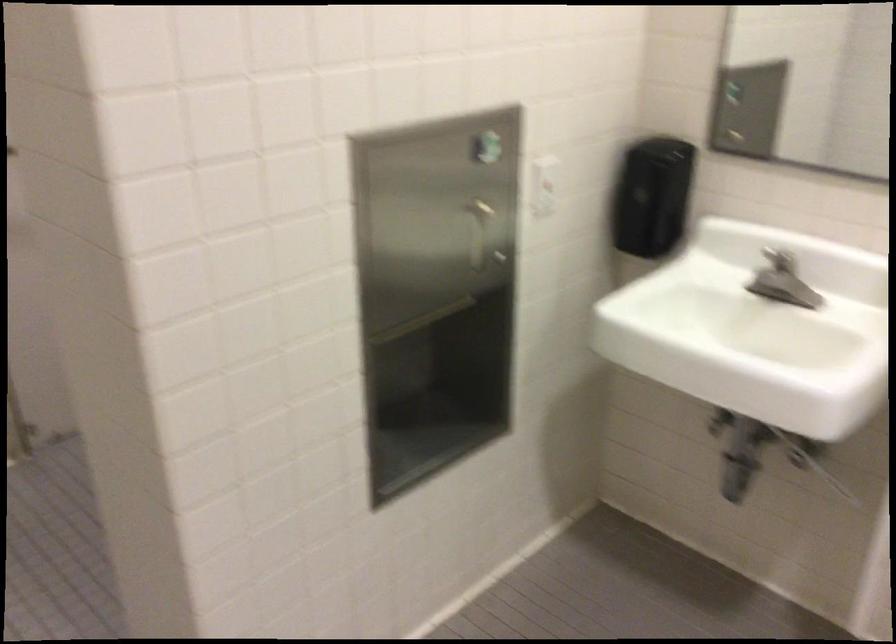
Where would you insert the metal keyhole? Please return your answer as a coordinate pair (x, y).

(493, 175)